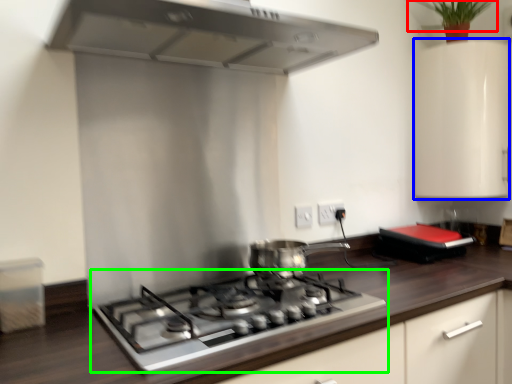
Question: Considering the real-world distances, which object is closest to plant (highlighted by a red box)? cabinetry (highlighted by a blue box) or gas stove (highlighted by a green box).

Choices:
 (A) cabinetry
 (B) gas stove

Answer: (A)